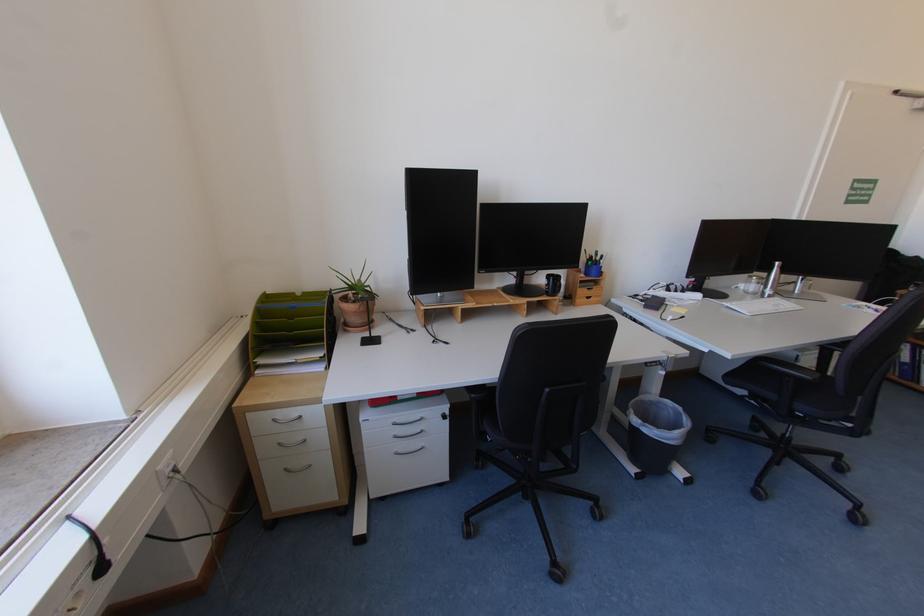
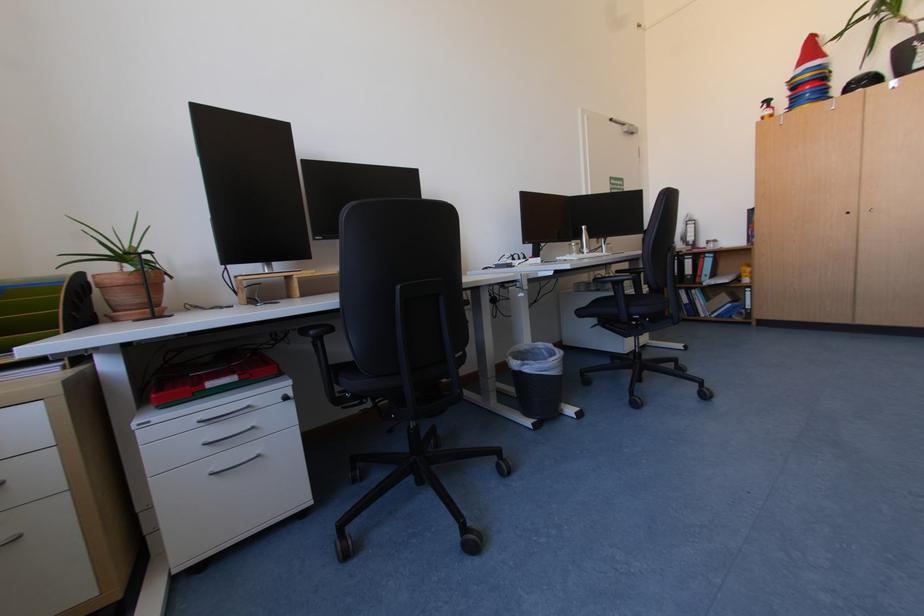
Question: Based on the continuous images, in which direction is the camera rotating? Reply with the corresponding letter.

Choices:
 (A) Left
 (B) Right
 (C) Up
 (D) Down

Answer: (B)